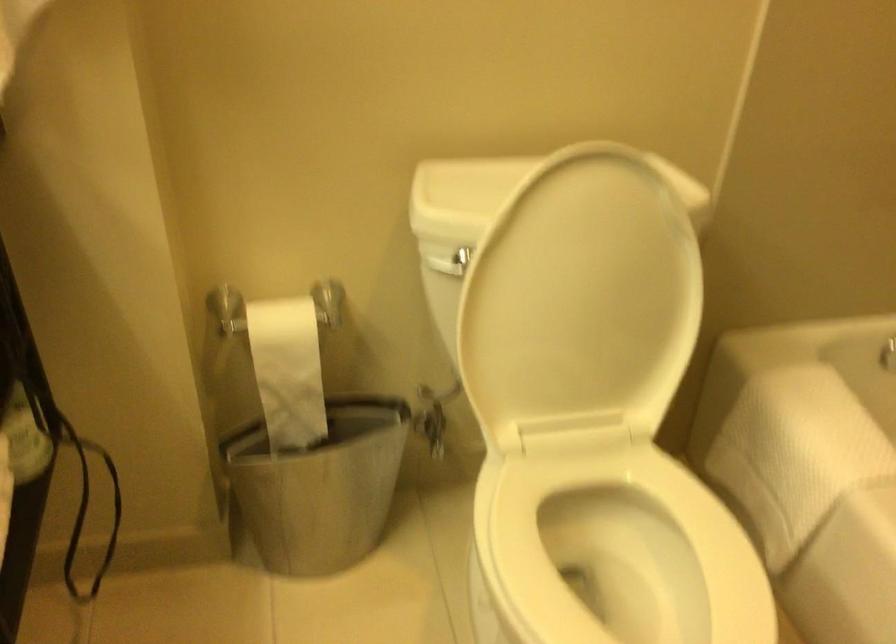
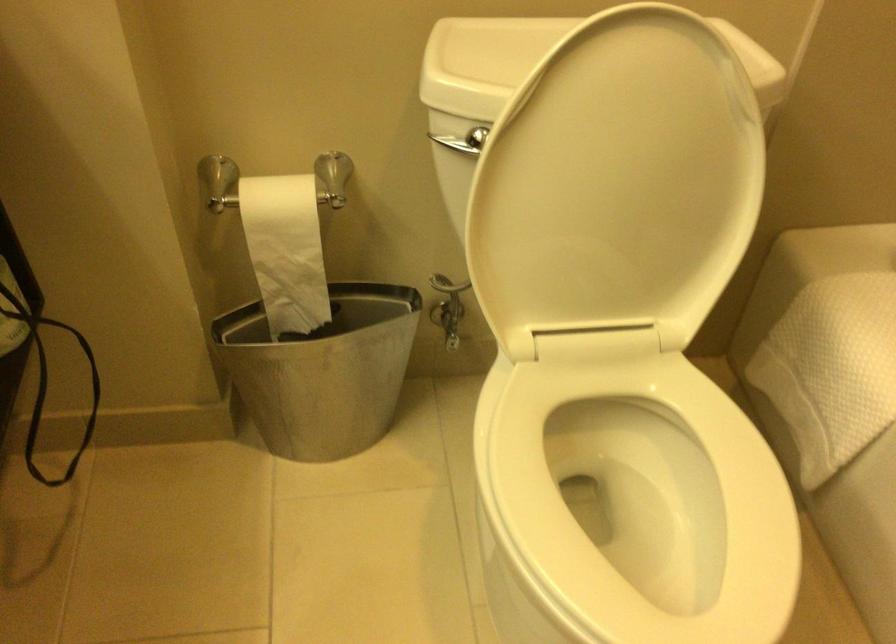
Find the pixel in the second image that matches point 323,482 in the first image.

(323, 371)